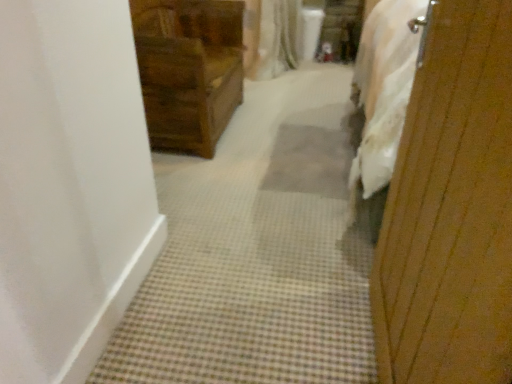
Question: Is wooden chest of drawers at upper left wider or thinner than wooden screen door at right?

Choices:
 (A) thin
 (B) wide

Answer: (B)

Question: Choose the correct answer: Is wooden chest of drawers at upper left inside wooden screen door at right or outside it?

Choices:
 (A) inside
 (B) outside

Answer: (B)

Question: Relative to wooden screen door at right, is wooden chest of drawers at upper left in front or behind?

Choices:
 (A) front
 (B) behind

Answer: (B)

Question: Considering the relative positions of wooden screen door at right and wooden chest of drawers at upper left in the image provided, is wooden screen door at right to the left or to the right of wooden chest of drawers at upper left?

Choices:
 (A) left
 (B) right

Answer: (B)

Question: Is wooden screen door at right wider or thinner than wooden chest of drawers at upper left?

Choices:
 (A) thin
 (B) wide

Answer: (A)

Question: Would you say wooden screen door at right is inside or outside wooden chest of drawers at upper left?

Choices:
 (A) outside
 (B) inside

Answer: (A)

Question: In terms of size, does wooden screen door at right appear bigger or smaller than wooden chest of drawers at upper left?

Choices:
 (A) small
 (B) big

Answer: (A)